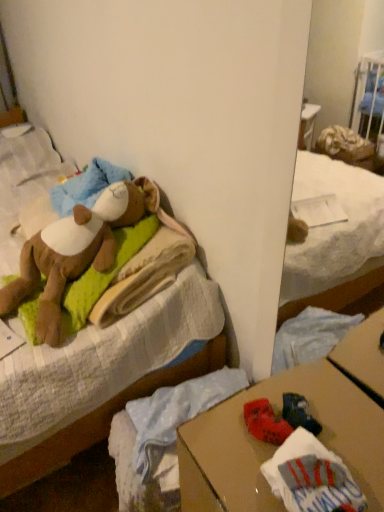
Question: Is the depth of soft brown teddy bear at upper left less than that of brown cardboard desk at lower right?

Choices:
 (A) yes
 (B) no

Answer: (B)

Question: Is soft brown teddy bear at upper left behind brown cardboard desk at lower right?

Choices:
 (A) yes
 (B) no

Answer: (A)

Question: Is soft brown teddy bear at upper left in contact with brown cardboard desk at lower right?

Choices:
 (A) yes
 (B) no

Answer: (B)

Question: Is soft brown teddy bear at upper left shorter than brown cardboard desk at lower right?

Choices:
 (A) no
 (B) yes

Answer: (B)

Question: Can you confirm if soft brown teddy bear at upper left is wider than brown cardboard desk at lower right?

Choices:
 (A) yes
 (B) no

Answer: (B)

Question: Is soft brown teddy bear at upper left inside the boundaries of soft plush bear at upper left, or outside?

Choices:
 (A) outside
 (B) inside

Answer: (B)

Question: In the image, is soft brown teddy bear at upper left on the left side or the right side of soft plush bear at upper left?

Choices:
 (A) right
 (B) left

Answer: (A)

Question: In terms of height, does soft brown teddy bear at upper left look taller or shorter compared to soft plush bear at upper left?

Choices:
 (A) short
 (B) tall

Answer: (A)

Question: Considering their positions, is soft brown teddy bear at upper left located in front of or behind soft plush bear at upper left?

Choices:
 (A) front
 (B) behind

Answer: (B)

Question: Is brown cardboard desk at lower right in front of or behind soft brown teddy bear at upper left in the image?

Choices:
 (A) front
 (B) behind

Answer: (A)

Question: Is point (248, 482) closer or farther from the camera than point (96, 256)?

Choices:
 (A) farther
 (B) closer

Answer: (B)

Question: Is brown cardboard desk at lower right to the left or to the right of soft brown teddy bear at upper left in the image?

Choices:
 (A) left
 (B) right

Answer: (B)

Question: Choose the correct answer: Is brown cardboard desk at lower right inside soft brown teddy bear at upper left or outside it?

Choices:
 (A) inside
 (B) outside

Answer: (B)

Question: Is soft plush bear at upper left bigger or smaller than brown cardboard desk at lower right?

Choices:
 (A) big
 (B) small

Answer: (A)

Question: Does point (34, 471) appear closer or farther from the camera than point (350, 412)?

Choices:
 (A) farther
 (B) closer

Answer: (A)